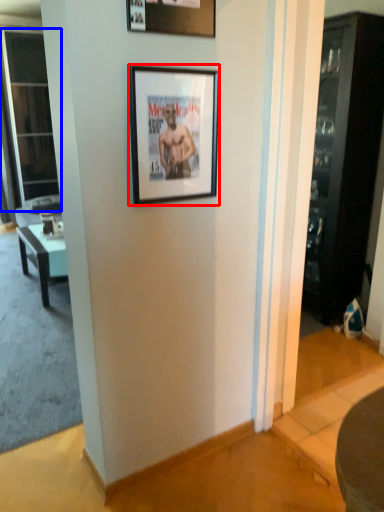
Question: Which object is closer to the camera taking this photo, picture frame (highlighted by a red box) or screen door (highlighted by a blue box)?

Choices:
 (A) picture frame
 (B) screen door

Answer: (A)